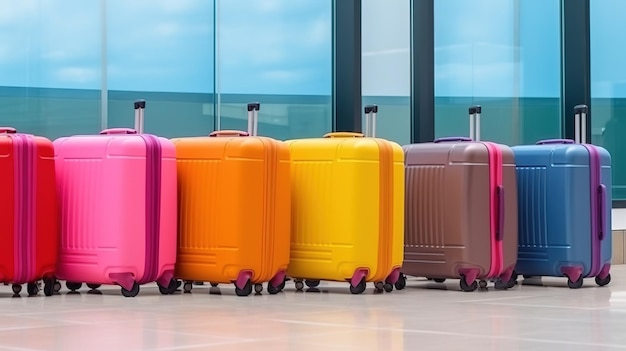
Where is `handle`? handle is located at coordinates (141, 114), (254, 122), (371, 119), (475, 117), (578, 123).